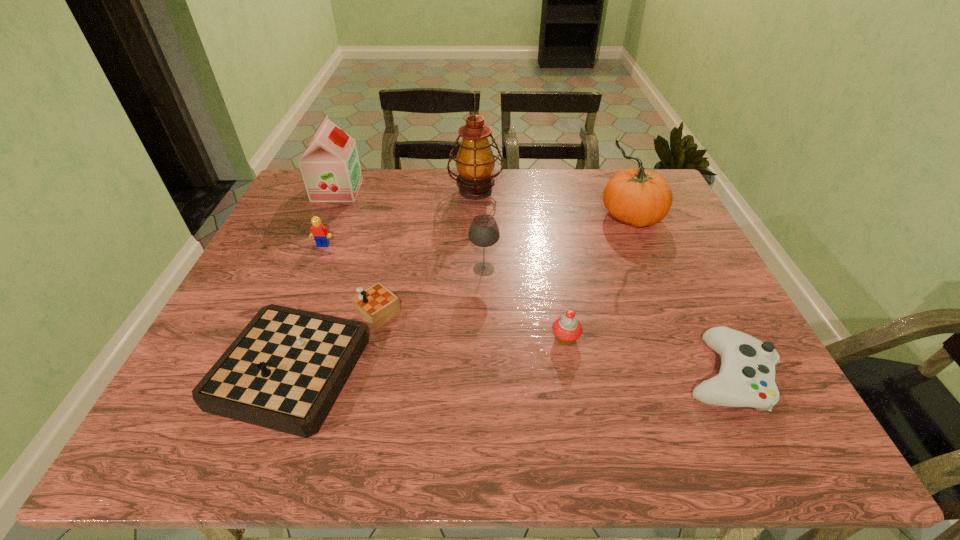
Identify the location of vacant space located 0.050m on the right of the pumpkin. (680, 217).

This screenshot has height=540, width=960. I want to click on free point located with the cap open on the soya milk, so click(x=443, y=190).

Locate an element on the screen. free region located 0.130m on the right of the fourth tallest object is located at coordinates (549, 269).

You are a GUI agent. You are given a task and a screenshot of the screen. Output one action in this format:
    pyautogui.click(x=<x>, y=<y>)
    Task: Click on the free point located on the face of the Lego
    This screenshot has width=960, height=540.
    Given the screenshot: What is the action you would take?
    pyautogui.click(x=301, y=297)

At what (x,y) coordinates should I click in order to perform the action: click on vacant region located 0.360m on the back of the sixth object from left to right. Please return your answer as a coordinate pair (x, y). Looking at the image, I should click on (546, 231).

Find the location of a particular element. blank space located on the back of the chessboard is located at coordinates (353, 232).

You are a GUI agent. You are given a task and a screenshot of the screen. Output one action in this format:
    pyautogui.click(x=<x>, y=<y>)
    Task: Click on the free location located on the back of the control
    Image resolution: width=960 pixels, height=540 pixels.
    Given the screenshot: What is the action you would take?
    pyautogui.click(x=683, y=284)

Where is `oil lamp located in the far edge section of the desktop`? This screenshot has height=540, width=960. oil lamp located in the far edge section of the desktop is located at coordinates (475, 161).

Find the location of a particular element. The width and height of the screenshot is (960, 540). pumpkin that is at the far edge is located at coordinates (637, 196).

Locate an element on the screen. The height and width of the screenshot is (540, 960). soya milk situated at the far edge is located at coordinates (330, 167).